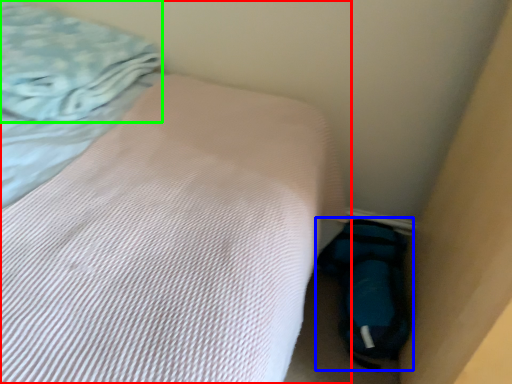
Question: Which is nearer to the bed (highlighted by a red box)? sleeping bag (highlighted by a blue box) or blanket (highlighted by a green box).

Choices:
 (A) sleeping bag
 (B) blanket

Answer: (B)